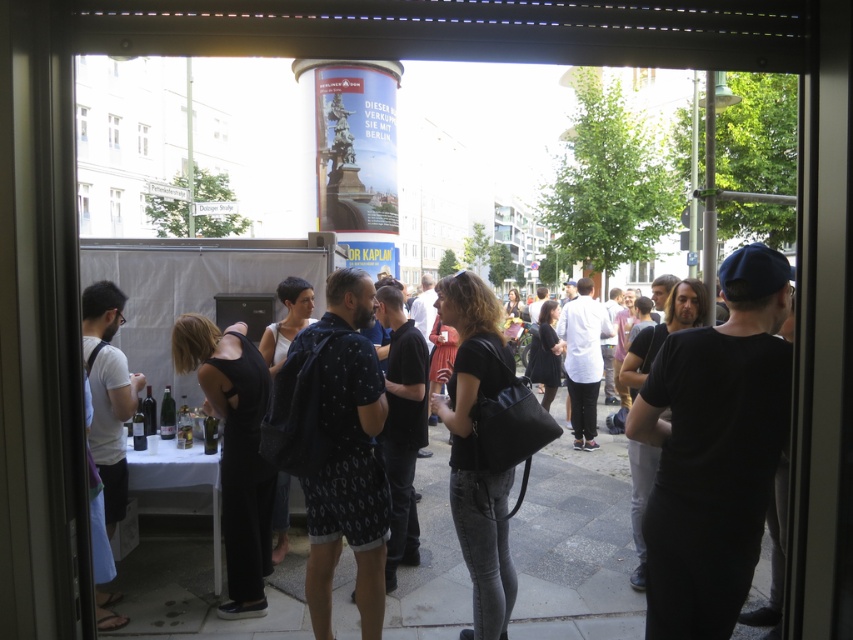
Is point (476, 600) less distant than point (219, 392)?

Yes, point (476, 600) is closer to viewer.

Who is more forward, (502, 632) or (251, 371)?

Point (502, 632)

The width and height of the screenshot is (853, 640). In order to click on black matte shirt at center in this screenshot , I will do click(x=476, y=449).

Locate an element on the screen. This screenshot has height=640, width=853. smooth concrete pavement at center is located at coordinates (575, 545).

Who is positioned more to the right, smooth concrete pavement at center or black matte jumpsuit at lower left?

Positioned to the right is smooth concrete pavement at center.

Locate an element on the screen. smooth concrete pavement at center is located at coordinates (575, 545).

Is point (442, 468) more distant than point (474, 480)?

Yes, it is behind point (474, 480).

Does smooth concrete pavement at center have a smaller size compared to black matte shirt at center?

Indeed, smooth concrete pavement at center has a smaller size compared to black matte shirt at center.

Locate an element on the screen. smooth concrete pavement at center is located at coordinates [x=575, y=545].

Identify the location of smooth concrete pavement at center. This screenshot has height=640, width=853. (575, 545).